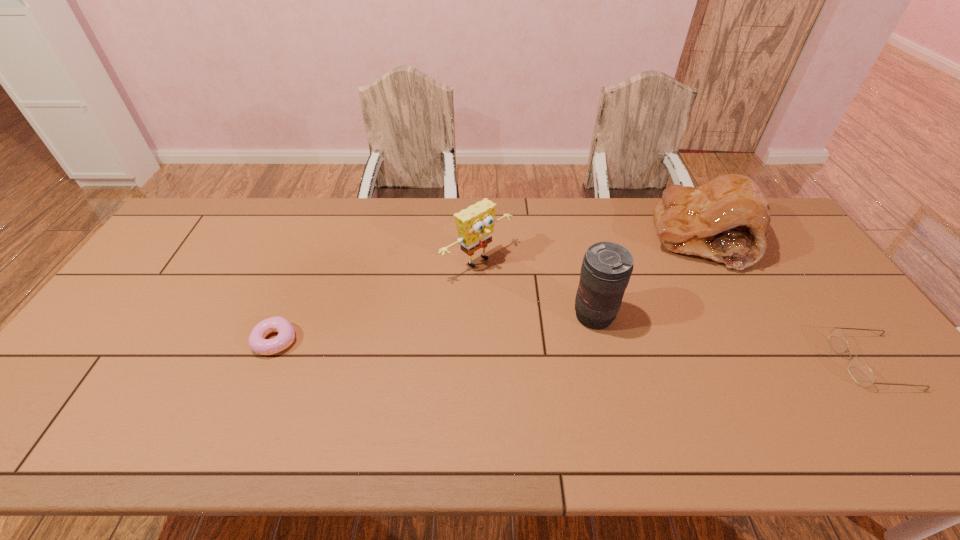
This screenshot has height=540, width=960. In order to click on free space between the spectacles and the sponge in this screenshot , I will do `click(674, 312)`.

Locate an element on the screen. Image resolution: width=960 pixels, height=540 pixels. free space that is in between the doughnut and the spectacles is located at coordinates (573, 352).

The image size is (960, 540). I want to click on vacant region between the spectacles and the shortest object, so click(x=573, y=352).

At what (x,y) coordinates should I click in order to perform the action: click on free space between the second object from left to right and the shortest object. Please return your answer as a coordinate pair (x, y). The image size is (960, 540). Looking at the image, I should click on (376, 301).

Locate an element on the screen. Image resolution: width=960 pixels, height=540 pixels. free space between the telephoto lens and the sponge is located at coordinates (536, 289).

Locate an element on the screen. This screenshot has width=960, height=540. empty location between the third object from left to right and the leftmost object is located at coordinates (435, 328).

Locate an element on the screen. Image resolution: width=960 pixels, height=540 pixels. empty location between the leftmost object and the bread is located at coordinates (489, 289).

Locate an element on the screen. Image resolution: width=960 pixels, height=540 pixels. free point between the third object from left to right and the shortest object is located at coordinates (435, 328).

Where is `object that stands as the third closest to the doughnut`? object that stands as the third closest to the doughnut is located at coordinates (727, 219).

Select which object appears as the fourth closest to the bread. Please provide its 2D coordinates. Your answer should be formatted as a tuple, i.e. [(x, y)], where the tuple contains the x and y coordinates of a point satisfying the conditions above.

[(286, 335)]